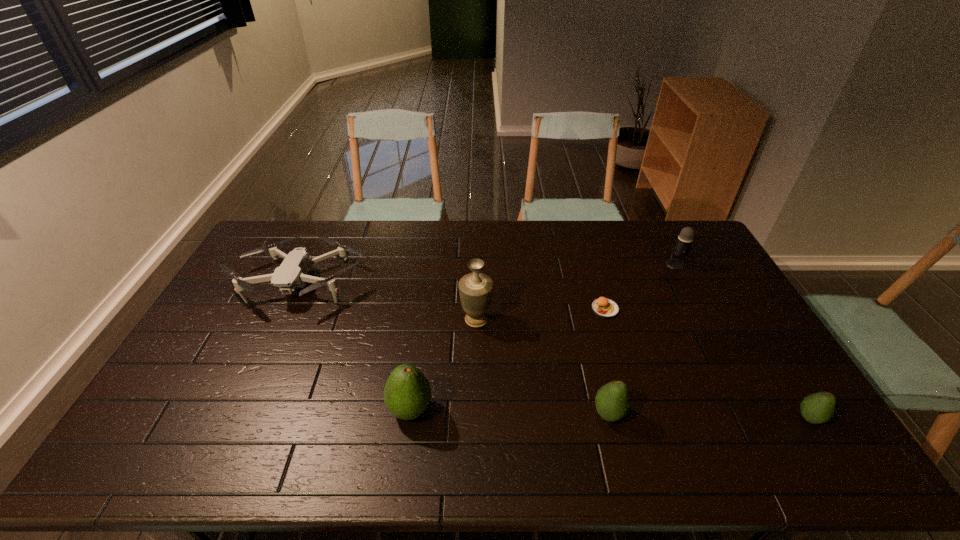
Please point a vacant point for placing a avocado on the left. Please provide its 2D coordinates. Your answer should be formatted as a tuple, i.e. [(x, y)], where the tuple contains the x and y coordinates of a point satisfying the conditions above.

[(216, 406)]